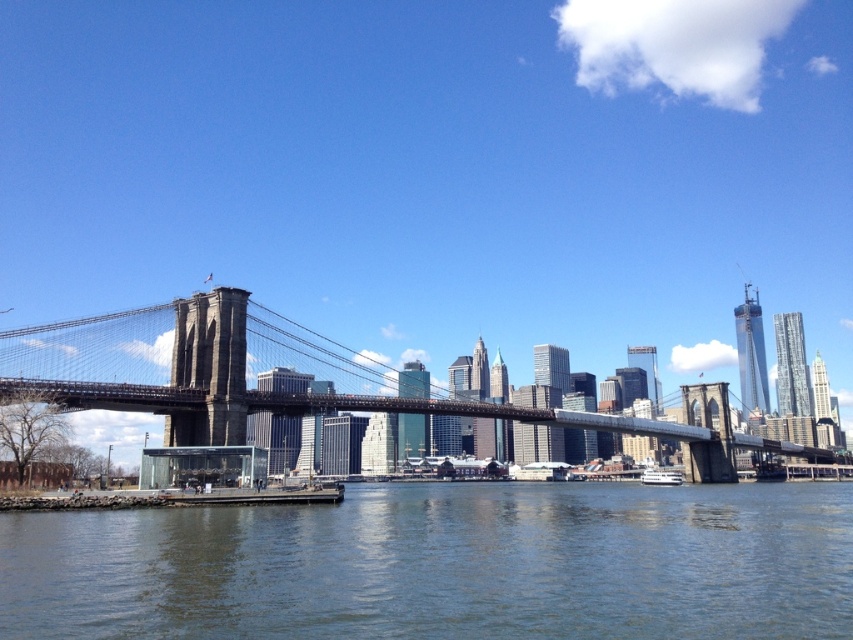
You are a tour guide explaining the Brooklyn Bridge to a group. You mention the dark gray steel suspension bridge at center and the white glossy boat at lower center. How far apart are these two landmarks?

The dark gray steel suspension bridge at center and the white glossy boat at lower center are 78.77 meters apart.